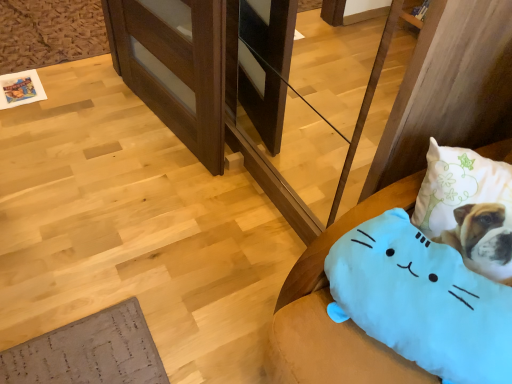
The height and width of the screenshot is (384, 512). In order to click on blue plush cat at lower right in this screenshot , I will do `click(401, 185)`.

Find the location of a particular element. This screenshot has height=384, width=512. blue plush cat at lower right is located at coordinates (428, 294).

The image size is (512, 384). What do you see at coordinates (428, 294) in the screenshot?
I see `blue plush cat at lower right` at bounding box center [428, 294].

You are a GUI agent. You are given a task and a screenshot of the screen. Output one action in this format:
    pyautogui.click(x=<x>, y=<y>)
    Task: Click on the blue plush cat at lower right
    
    Given the screenshot: What is the action you would take?
    pyautogui.click(x=401, y=185)

From a real-world perspective, is blue plush cat at lower right located beneath wooden at left?

No, from a real-world perspective, blue plush cat at lower right is not under wooden at left.

Which is in front, blue plush cat at lower right or wooden at left?

blue plush cat at lower right is closer to the camera.

The width and height of the screenshot is (512, 384). I want to click on pillow to the right of wooden at left, so click(x=428, y=294).

Consider the image. Which of these two, blue plush cat at lower right or wooden at left, is smaller?

blue plush cat at lower right is smaller.

From a real-world perspective, which is physically below, blue plush cat at lower right or wooden at left?

wooden at left.

How distant is blue plush cat at lower right from wooden at left?

37.21 inches.

Would you say blue plush cat at lower right is inside or outside wooden at left?

blue plush cat at lower right cannot be found inside wooden at left.

Can you tell me how much blue plush cat at lower right and wooden at left differ in facing direction?

There is a 1.16-degree angle between the facing directions of blue plush cat at lower right and wooden at left.

Who is smaller, blue plush cat at lower right or blue plush cat at lower right?

With smaller size is blue plush cat at lower right.

Between blue plush cat at lower right and blue plush cat at lower right, which one has more height?

Standing taller between the two is blue plush cat at lower right.

Where is `furniture on the left of the blue plush cat at lower right`? furniture on the left of the blue plush cat at lower right is located at coordinates (401, 185).

From a real-world perspective, is blue plush cat at lower right over blue plush cat at lower right?

Yes, from a real-world perspective, blue plush cat at lower right is on top of blue plush cat at lower right.

How many degrees apart are the facing directions of blue plush cat at lower right and blue plush cat at lower right?

They differ by 20.9 degrees in their facing directions.

Is blue plush cat at lower right behind blue plush cat at lower right?

Yes, it is behind blue plush cat at lower right.

Considering the relative positions of blue plush cat at lower right and blue plush cat at lower right in the image provided, is blue plush cat at lower right to the right of blue plush cat at lower right from the viewer's perspective?

Incorrect, blue plush cat at lower right is not on the right side of blue plush cat at lower right.

From the image's perspective, is wooden at left above or below blue plush cat at lower right?

wooden at left is situated higher than blue plush cat at lower right in the image.

From a real-world perspective, is wooden at left located beneath blue plush cat at lower right?

Indeed, from a real-world perspective, wooden at left is positioned beneath blue plush cat at lower right.

Is wooden at left taller than blue plush cat at lower right?

No, wooden at left is not taller than blue plush cat at lower right.

Considering the relative sizes of wooden at left and blue plush cat at lower right in the image provided, is wooden at left wider than blue plush cat at lower right?

No.

Is wooden at left at the left side of blue plush cat at lower right?

Correct, you'll find wooden at left to the left of blue plush cat at lower right.

From a real-world perspective, who is located higher, wooden at left or blue plush cat at lower right?

In real-world perspective, blue plush cat at lower right is above.

Is point (206, 12) positioned in front of point (377, 249)?

No, (206, 12) is further to viewer.

Identify the location of shelf located underneath the blue plush cat at lower right (from a real-world perspective). (175, 66).

Locate an element on the screen. The width and height of the screenshot is (512, 384). furniture lying below the wooden at left (from the image's perspective) is located at coordinates (401, 185).

Looking at this image, when comparing their distances from blue plush cat at lower right, does blue plush cat at lower right or wooden at left seem further?

wooden at left.

Which object lies further to the anchor point wooden at left, blue plush cat at lower right or blue plush cat at lower right?

Based on the image, blue plush cat at lower right appears to be further to wooden at left.

Based on their spatial positions, is wooden at left or blue plush cat at lower right closer to blue plush cat at lower right?

blue plush cat at lower right is positioned closer to the anchor blue plush cat at lower right.

Estimate the real-world distances between objects in this image. Which object is further from blue plush cat at lower right, blue plush cat at lower right or wooden at left?

wooden at left lies further to blue plush cat at lower right than the other object.

Which object lies further to the anchor point blue plush cat at lower right, wooden at left or blue plush cat at lower right?

wooden at left lies further to blue plush cat at lower right than the other object.

Which object lies nearer to the anchor point wooden at left, blue plush cat at lower right or blue plush cat at lower right?

Based on the image, blue plush cat at lower right appears to be nearer to wooden at left.

Locate an element on the screen. The image size is (512, 384). furniture between wooden at left and blue plush cat at lower right in the horizontal direction is located at coordinates (401, 185).